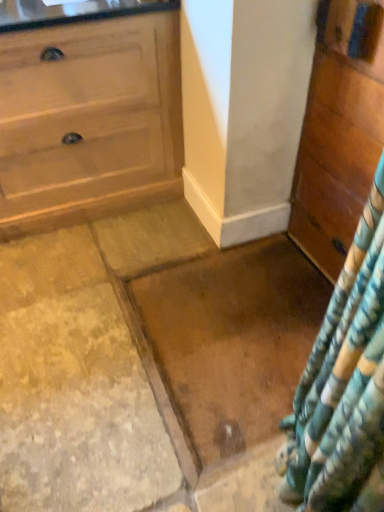
Question: Is brown polished granite at center shorter than wooden chest of drawers at right?

Choices:
 (A) yes
 (B) no

Answer: (A)

Question: Does brown polished granite at center have a greater height compared to wooden chest of drawers at right?

Choices:
 (A) no
 (B) yes

Answer: (A)

Question: Considering the relative sizes of brown polished granite at center and wooden chest of drawers at right in the image provided, is brown polished granite at center wider than wooden chest of drawers at right?

Choices:
 (A) no
 (B) yes

Answer: (B)

Question: Is brown polished granite at center to the right of wooden chest of drawers at right from the viewer's perspective?

Choices:
 (A) yes
 (B) no

Answer: (B)

Question: Is brown polished granite at center looking in the opposite direction of wooden chest of drawers at right?

Choices:
 (A) no
 (B) yes

Answer: (A)

Question: Is brown polished granite at center closer to camera compared to wooden chest of drawers at right?

Choices:
 (A) yes
 (B) no

Answer: (B)

Question: Does wooden chest of drawers at right have a lesser height compared to brown polished granite at center?

Choices:
 (A) yes
 (B) no

Answer: (B)

Question: From the image's perspective, is wooden chest of drawers at right over brown polished granite at center?

Choices:
 (A) no
 (B) yes

Answer: (B)

Question: Is wooden chest of drawers at right oriented towards brown polished granite at center?

Choices:
 (A) no
 (B) yes

Answer: (B)

Question: Does wooden chest of drawers at right have a lesser width compared to brown polished granite at center?

Choices:
 (A) yes
 (B) no

Answer: (A)

Question: From a real-world perspective, is wooden chest of drawers at right over brown polished granite at center?

Choices:
 (A) no
 (B) yes

Answer: (B)

Question: Is wooden chest of drawers at right to the right of brown polished granite at center from the viewer's perspective?

Choices:
 (A) yes
 (B) no

Answer: (A)

Question: From the image's perspective, relative to brown polished granite at center, is wooden chest of drawers at right above or below?

Choices:
 (A) above
 (B) below

Answer: (A)